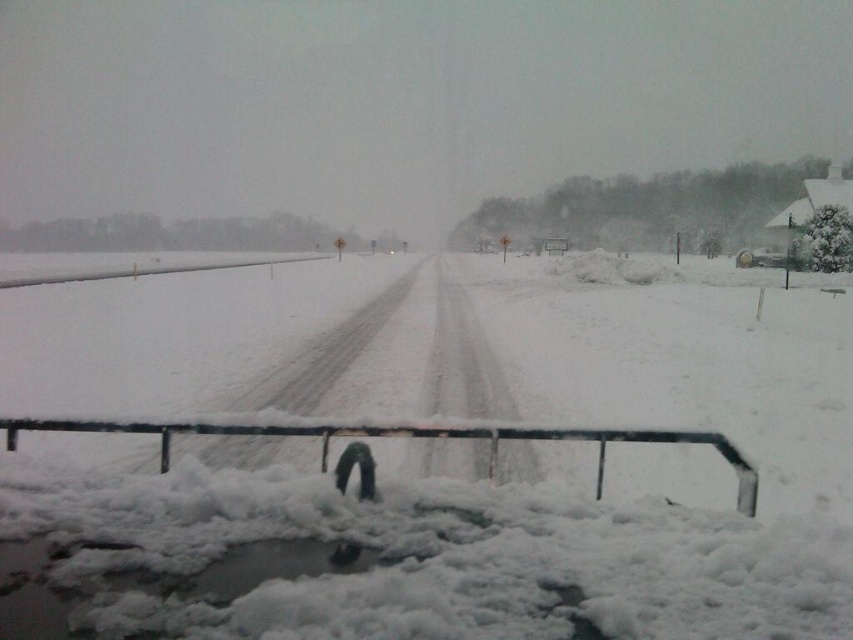
Between white fluffy snow at center and black metal rail at center, which one is positioned lower?

black metal rail at center is lower down.

The height and width of the screenshot is (640, 853). Describe the element at coordinates (471, 496) in the screenshot. I see `white fluffy snow at center` at that location.

You are a GUI agent. You are given a task and a screenshot of the screen. Output one action in this format:
    pyautogui.click(x=<x>, y=<y>)
    Task: Click on the white fluffy snow at center
    This screenshot has width=853, height=640.
    Given the screenshot: What is the action you would take?
    pyautogui.click(x=471, y=496)

Identify the location of white fluffy snow at center. (471, 496).

Who is taller, white fluffy snow at center or white matte rail at left?

white matte rail at left is taller.

Where is `white fluffy snow at center`? The image size is (853, 640). white fluffy snow at center is located at coordinates (471, 496).

Is point (839, 604) farther from camera compared to point (143, 266)?

No, it is not.

Where is `white fluffy snow at center`? The width and height of the screenshot is (853, 640). white fluffy snow at center is located at coordinates (471, 496).

Between black metal rail at center and white matte rail at left, which one has less height?

With less height is black metal rail at center.

Is point (633, 433) in front of point (138, 269)?

Yes, point (633, 433) is in front of point (138, 269).

You are a GUI agent. You are given a task and a screenshot of the screen. Output one action in this format:
    pyautogui.click(x=<x>, y=<y>)
    Task: Click on the black metal rail at center
    
    Given the screenshot: What is the action you would take?
    pyautogui.click(x=404, y=436)